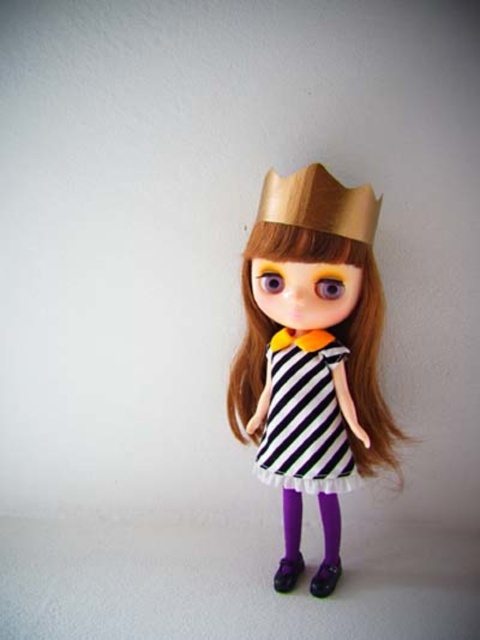
Is black striped dress at center behind wooden crown at center?

That is True.

Image resolution: width=480 pixels, height=640 pixels. I want to click on black striped dress at center, so click(304, 417).

Does black and white striped dress at center lie behind wooden crown at center?

Yes, it is behind wooden crown at center.

Describe the element at coordinates (312, 349) in the screenshot. I see `black and white striped dress at center` at that location.

You are a GUI agent. You are given a task and a screenshot of the screen. Output one action in this format:
    pyautogui.click(x=<x>, y=<y>)
    Task: Click on the black and white striped dress at center
    This screenshot has width=480, height=640.
    Given the screenshot: What is the action you would take?
    pyautogui.click(x=312, y=349)

Is black and white striped dress at center below black striped dress at center?

Incorrect, black and white striped dress at center is not positioned below black striped dress at center.

Does black and white striped dress at center come in front of black striped dress at center?

Yes, black and white striped dress at center is in front of black striped dress at center.

Does point (348, 410) come behind point (282, 417)?

No.

Locate an element on the screen. This screenshot has width=480, height=640. black and white striped dress at center is located at coordinates (312, 349).